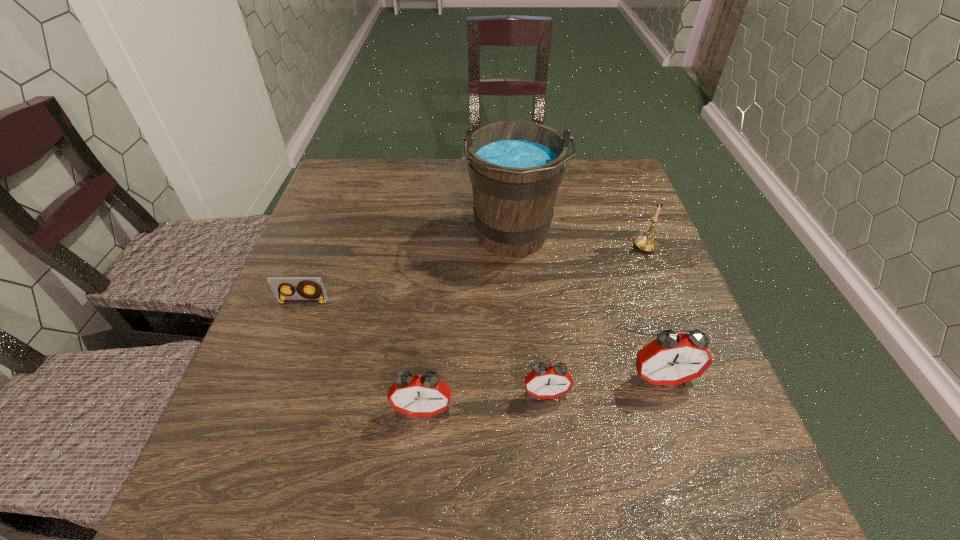
In the current image, all alarm clocks are evenly spaced. To maintain this equal spacing, where should an additional alarm clock be placed on the left? Please point out a free spot. Please provide its 2D coordinates. Your answer should be formatted as a tuple, i.e. [(x, y)], where the tuple contains the x and y coordinates of a point satisfying the conditions above.

[(294, 427)]